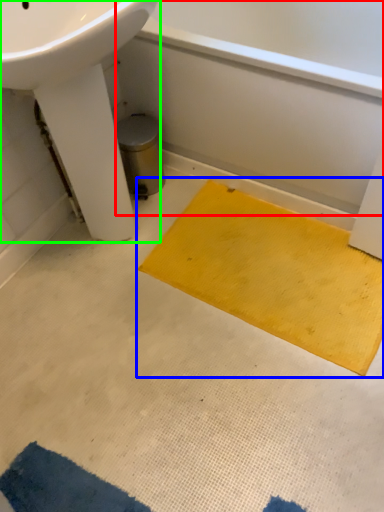
Question: Which object is the farthest from bath (highlighted by a red box)? Choose among these: doormat (highlighted by a blue box) or sink (highlighted by a green box).

Choices:
 (A) doormat
 (B) sink

Answer: (B)